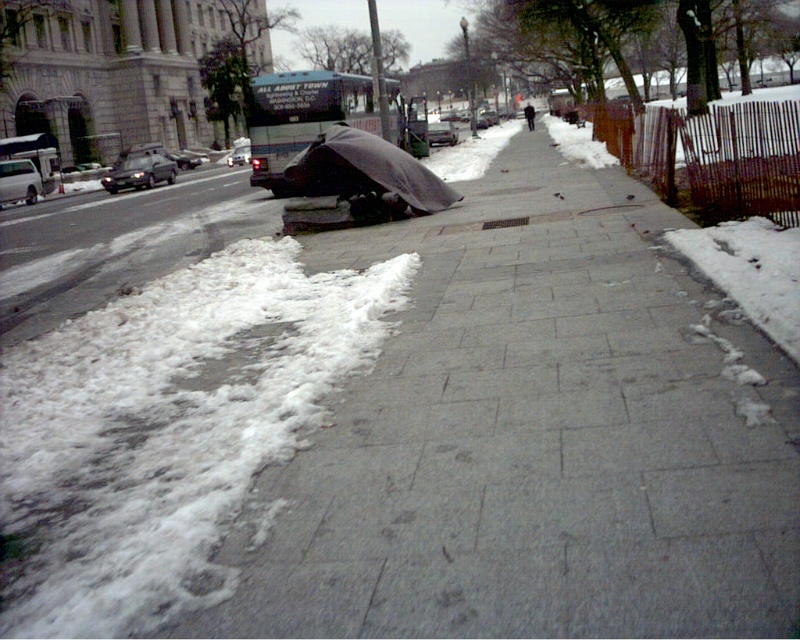
Is white powdery snow at lower left to the right of dark gray tarp at center from the viewer's perspective?

No, white powdery snow at lower left is not to the right of dark gray tarp at center.

Does white powdery snow at lower left appear under dark gray tarp at center?

Yes.

Between point (118, 381) and point (413, 163), which one is positioned behind?

Positioned behind is point (413, 163).

This screenshot has height=640, width=800. I want to click on white powdery snow at lower left, so click(x=166, y=429).

Can you confirm if gray concrete sidewalk at center is taller than silver metallic sedan at left?

Indeed, gray concrete sidewalk at center has a greater height compared to silver metallic sedan at left.

The height and width of the screenshot is (640, 800). In order to click on gray concrete sidewalk at center in this screenshot , I will do `click(533, 438)`.

How far apart are gray concrete sidewalk at center and dark gray jacket at center?

gray concrete sidewalk at center is 34.62 meters away from dark gray jacket at center.

Between gray concrete sidewalk at center and dark gray jacket at center, which one has less height?

gray concrete sidewalk at center is shorter.

Between point (536, 228) and point (526, 120), which one is positioned in front?

Positioned in front is point (536, 228).

At what (x,y) coordinates should I click in order to perform the action: click on gray concrete sidewalk at center. Please return your answer as a coordinate pair (x, y). The width and height of the screenshot is (800, 640). Looking at the image, I should click on (533, 438).